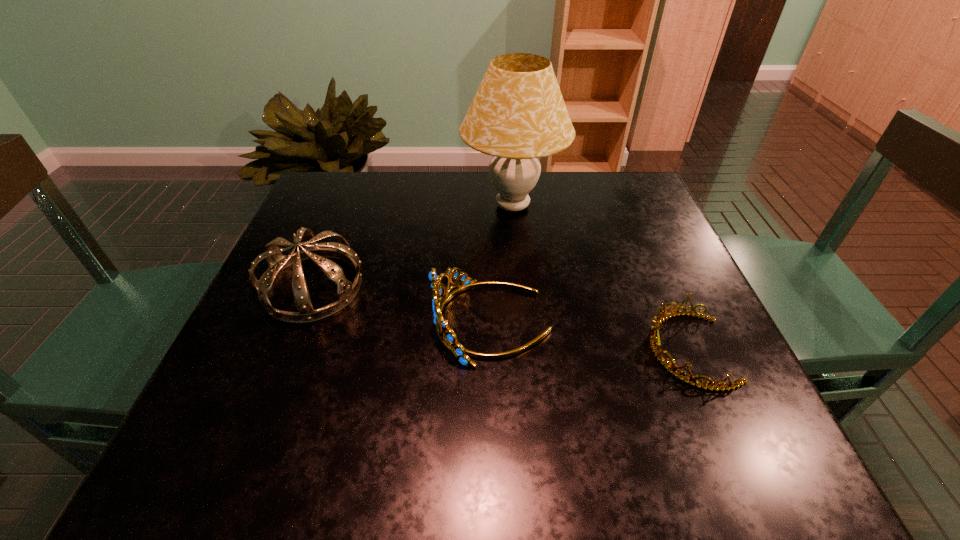
Where is `the tallest object`? This screenshot has width=960, height=540. the tallest object is located at coordinates (518, 115).

Identify the location of lampshade. This screenshot has height=540, width=960. (518, 115).

At what (x,y) coordinates should I click in order to perform the action: click on the leftmost tiara. Please return your answer as a coordinate pair (x, y). Looking at the image, I should click on (346, 291).

Image resolution: width=960 pixels, height=540 pixels. Identify the location of the second tiara from right to left. (447, 337).

Image resolution: width=960 pixels, height=540 pixels. What are the coordinates of `the rightmost object` in the screenshot? It's located at (656, 347).

Find the location of a particular element. The image size is (960, 540). the shortest tiara is located at coordinates (656, 347).

Locate an element on the screen. The height and width of the screenshot is (540, 960). free region located 0.200m on the front of the lampshade is located at coordinates (521, 298).

This screenshot has width=960, height=540. In order to click on free space located on the right of the leftmost object in this screenshot , I will do `click(459, 287)`.

At what (x,y) coordinates should I click in order to perform the action: click on vacant space located on the front-facing side of the second tiara from left to right. Please return your answer as a coordinate pair (x, y). The image size is (960, 540). Looking at the image, I should click on (282, 322).

The height and width of the screenshot is (540, 960). I want to click on free location located 0.290m on the front-facing side of the second tiara from left to right, so click(282, 322).